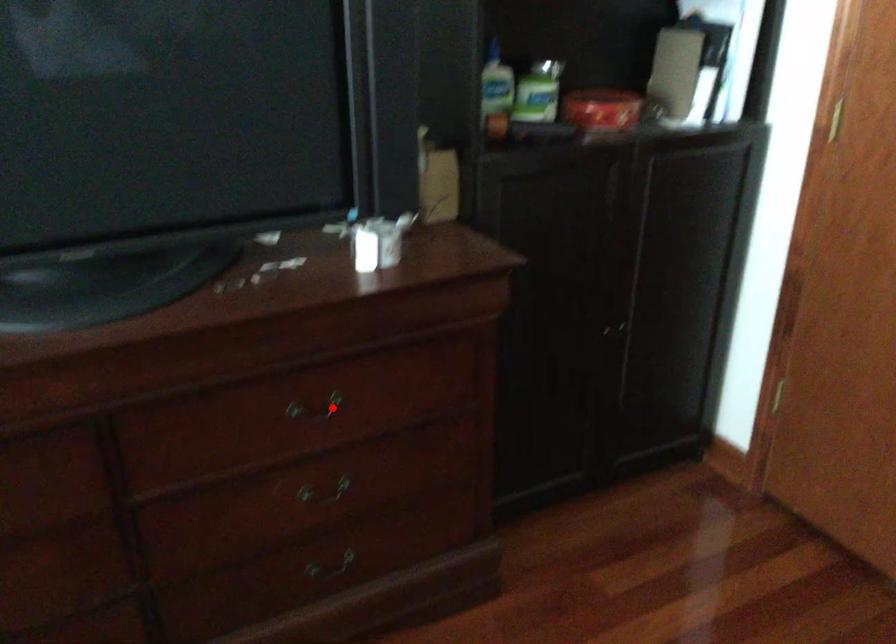
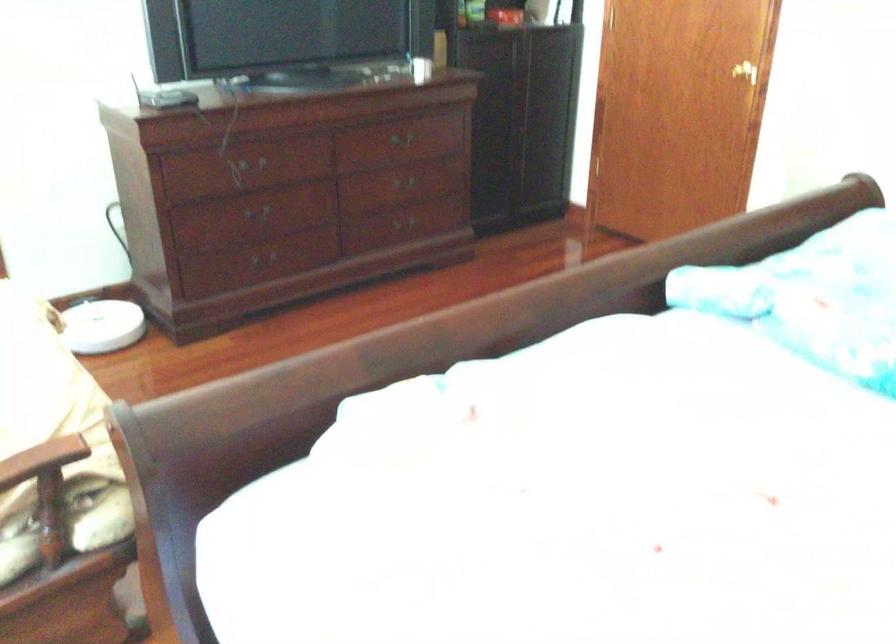
Question: I am providing you with two images of the same scene from different viewpoints. Given a red point in image1, look at the same physical point in image2. Is it:

Choices:
 (A) Closer to the viewpoint
 (B) Farther from the viewpoint

Answer: (B)